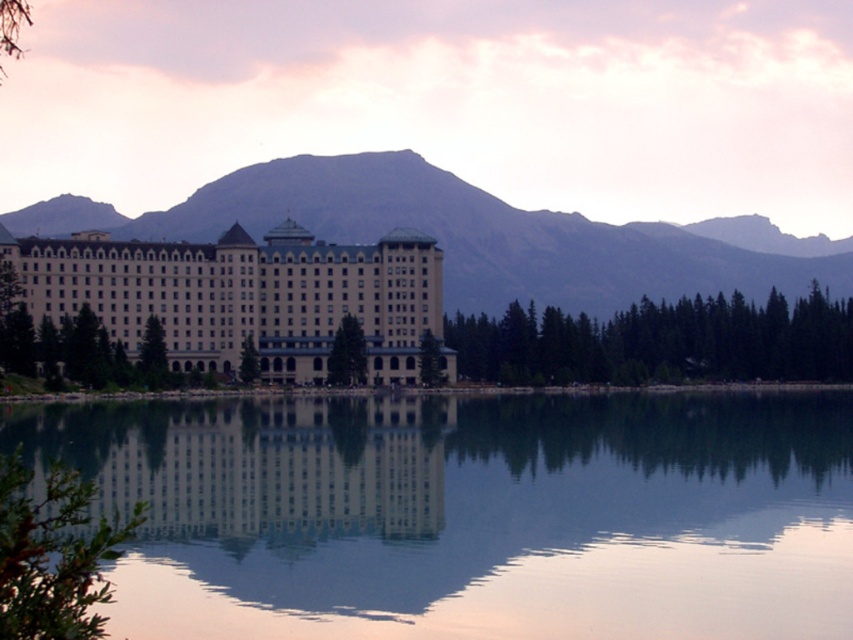
Question: Can you confirm if gray rocky mountain at center is positioned to the right of white glass building at center?

Choices:
 (A) no
 (B) yes

Answer: (B)

Question: Is the position of transparent glass water at center more distant than that of white glass building at center?

Choices:
 (A) yes
 (B) no

Answer: (B)

Question: Is the position of gray rocky mountain at center less distant than that of beige stone hotel at center?

Choices:
 (A) no
 (B) yes

Answer: (A)

Question: Which point is farther to the camera?

Choices:
 (A) beige stone hotel at center
 (B) transparent glass water at center

Answer: (A)

Question: Which of these objects is positioned farthest from the beige stone hotel at center?

Choices:
 (A) transparent glass water at center
 (B) white glass building at center

Answer: (A)

Question: Which point appears farthest from the camera in this image?

Choices:
 (A) (430, 420)
 (B) (325, 312)

Answer: (B)